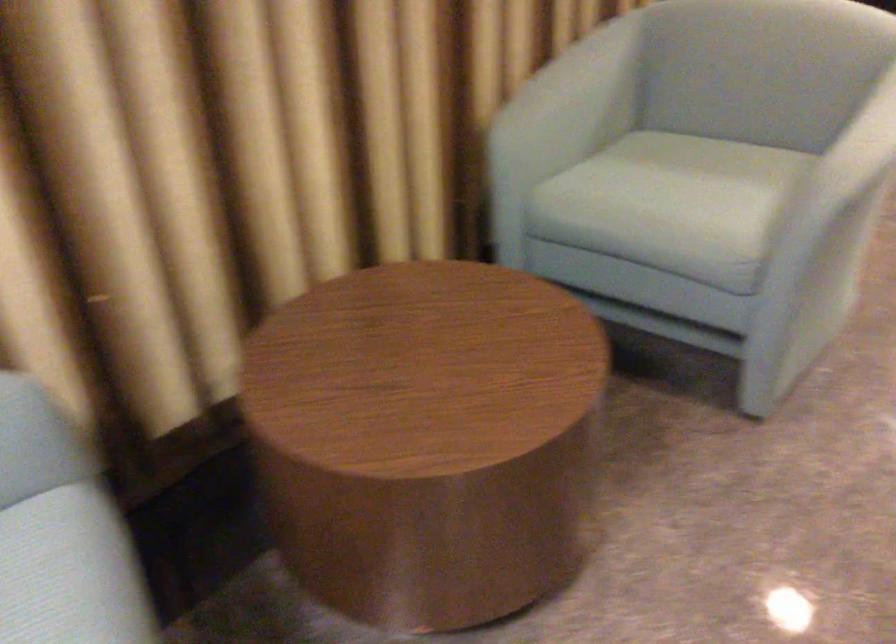
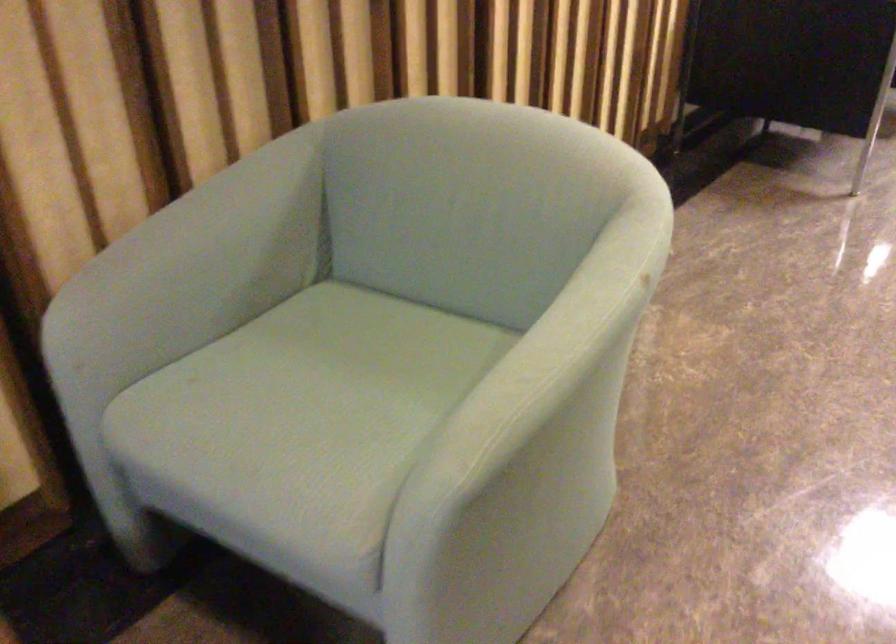
The point at (668,187) is marked in the first image. Where is the corresponding point in the second image?

(305, 398)